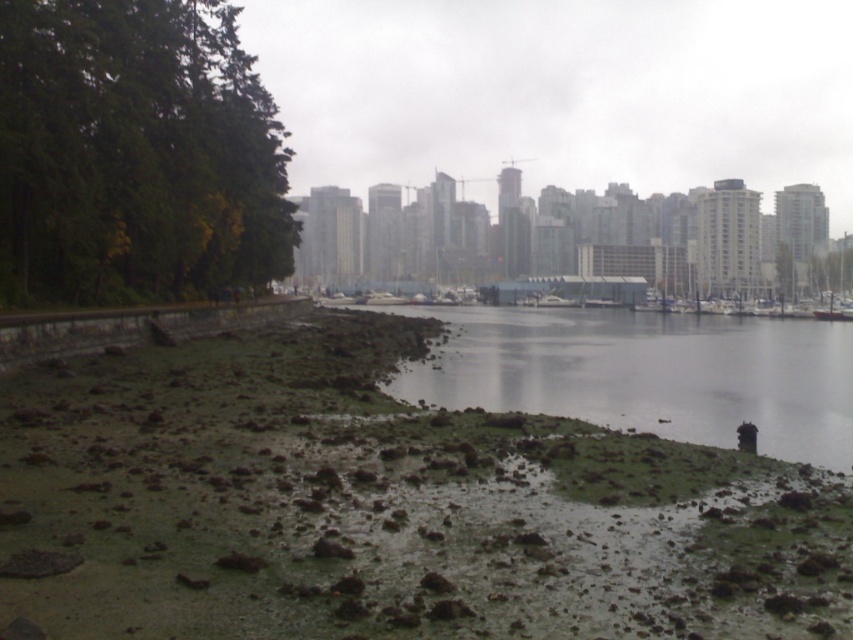
Question: Is the position of green leafy trees at left less distant than that of white glossy boat at center?

Choices:
 (A) no
 (B) yes

Answer: (B)

Question: Which object appears closest to the camera in this image?

Choices:
 (A) green leafy trees at left
 (B) white glossy boat at center
 (C) green mossy mud at lower center

Answer: (C)

Question: Can you confirm if green leafy trees at left is positioned to the left of white glossy boat at center?

Choices:
 (A) yes
 (B) no

Answer: (A)

Question: Among these points, which one is nearest to the camera?

Choices:
 (A) (292, 204)
 (B) (376, 298)
 (C) (711, 332)

Answer: (C)

Question: Does green mossy mud at lower center have a lesser width compared to white glossy boat at center?

Choices:
 (A) no
 (B) yes

Answer: (A)

Question: Which point is farther to the camera?

Choices:
 (A) coord(570,317)
 (B) coord(71,147)
 (C) coord(376,291)

Answer: (C)